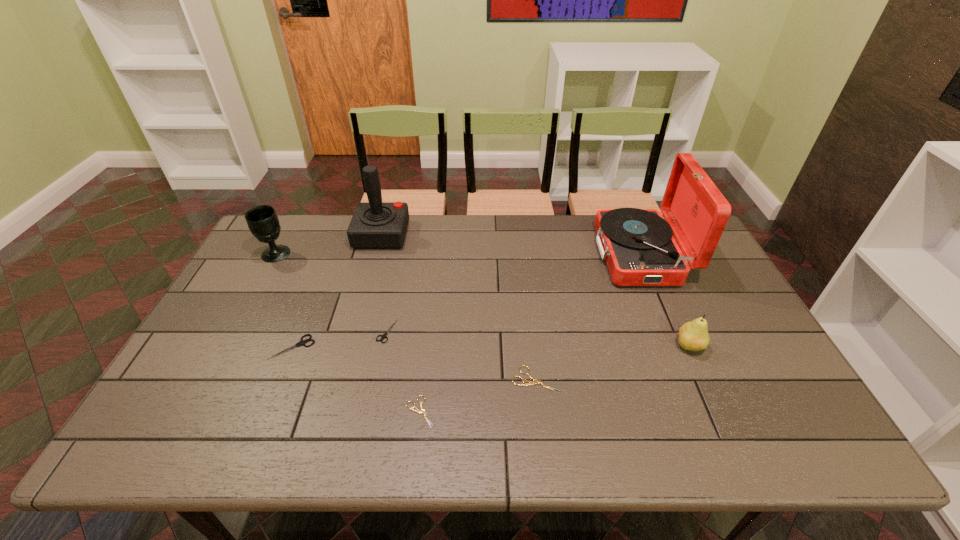
Where is `vacant area that lies between the third shears from left to right and the joystick`? vacant area that lies between the third shears from left to right and the joystick is located at coordinates (401, 323).

Where is `empty location between the red joystick and the bigger beige shears`? This screenshot has height=540, width=960. empty location between the red joystick and the bigger beige shears is located at coordinates (459, 307).

Where is `empty space between the phonograph_record and the red joystick`? empty space between the phonograph_record and the red joystick is located at coordinates (511, 245).

Where is `empty space that is in between the farther beige shears and the shortest shears`? empty space that is in between the farther beige shears and the shortest shears is located at coordinates (478, 396).

At what (x,y) coordinates should I click in order to perform the action: click on free spot between the fourth tallest object and the phonograph_record. Please return your answer as a coordinate pair (x, y). The image size is (960, 540). Looking at the image, I should click on (664, 301).

This screenshot has height=540, width=960. What are the coordinates of `unoccupied position between the nearest object and the second nearest shears` in the screenshot? It's located at coord(478,396).

Where is `free space between the seventh object from right to left and the joystick`? The height and width of the screenshot is (540, 960). free space between the seventh object from right to left and the joystick is located at coordinates (337, 291).

Locate an element on the screen. The width and height of the screenshot is (960, 540). object that is the closest to the smaller black shears is located at coordinates (302, 342).

At what (x,y) coordinates should I click in order to perform the action: click on object that is the seventh closest to the smaller black shears. Please return your answer as a coordinate pair (x, y). The width and height of the screenshot is (960, 540). Looking at the image, I should click on (693, 335).

Locate an element on the screen. The image size is (960, 540). shears that is the third closest one to the third farthest shears is located at coordinates (302, 342).